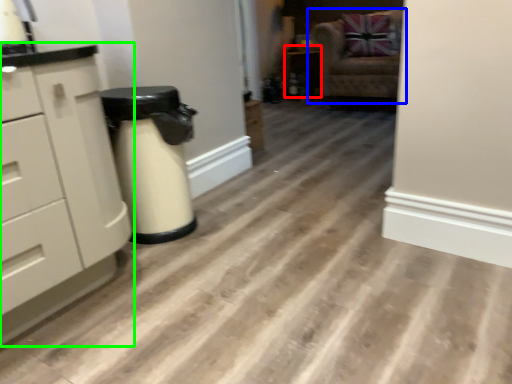
Question: Considering the real-world distances, which object is farthest from cabinetry (highlighted by a red box)? chair (highlighted by a blue box) or chest of drawers (highlighted by a green box)?

Choices:
 (A) chair
 (B) chest of drawers

Answer: (B)